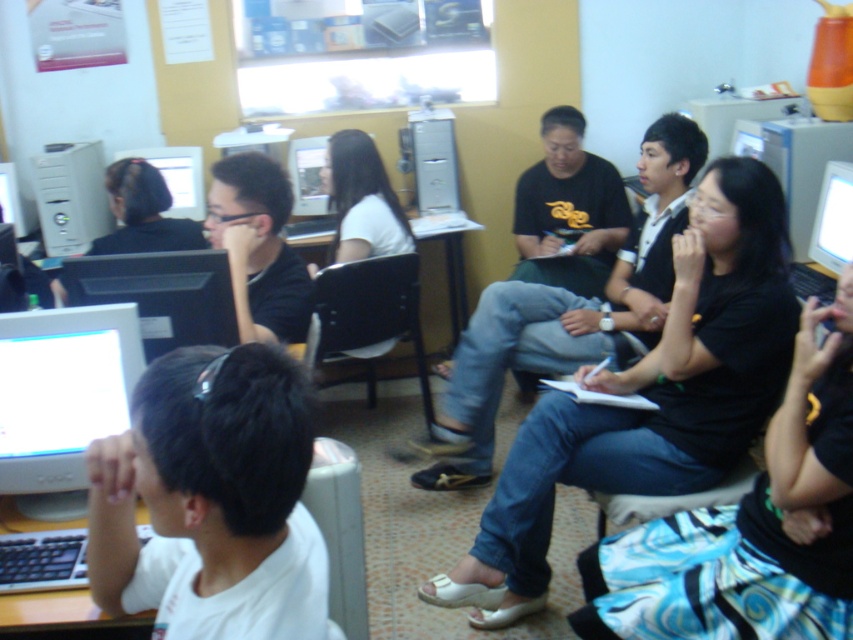
Question: Which is nearer to the black matte hair at upper left?

Choices:
 (A) bright white plastic monitor at upper right
 (B) black matte skirt at center
 (C) matte black monitor at upper left
 (D) white matte shirt at left

Answer: (C)

Question: Can you confirm if white matte shirt at left is positioned below bright white plastic monitor at upper right?

Choices:
 (A) yes
 (B) no

Answer: (A)

Question: Can you confirm if black matte shirt at left is bigger than matte gray computer tower at center?

Choices:
 (A) yes
 (B) no

Answer: (A)

Question: Among these points, which one is farthest from the camera?

Choices:
 (A) (103, 401)
 (B) (125, 227)
 (C) (251, 250)
 (D) (822, 454)

Answer: (B)

Question: Based on their relative distances, which object is farther from the white matte shirt at left?

Choices:
 (A) black matte skirt at center
 (B) black matte hair at upper left

Answer: (B)

Question: Can you confirm if white matte shirt at left is positioned to the left of black matte hair at upper left?

Choices:
 (A) yes
 (B) no

Answer: (B)